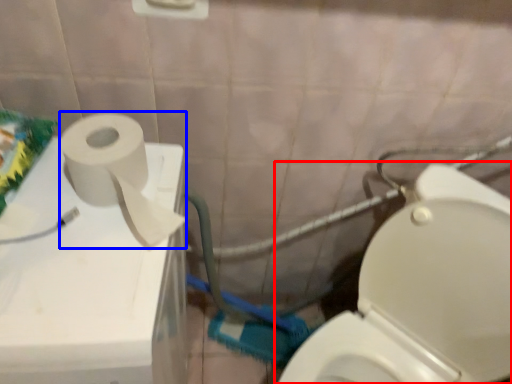
Question: Which point is further to the camera, toilet (highlighted by a red box) or toiletry paper (highlighted by a blue box)?

Choices:
 (A) toilet
 (B) toiletry paper

Answer: (B)